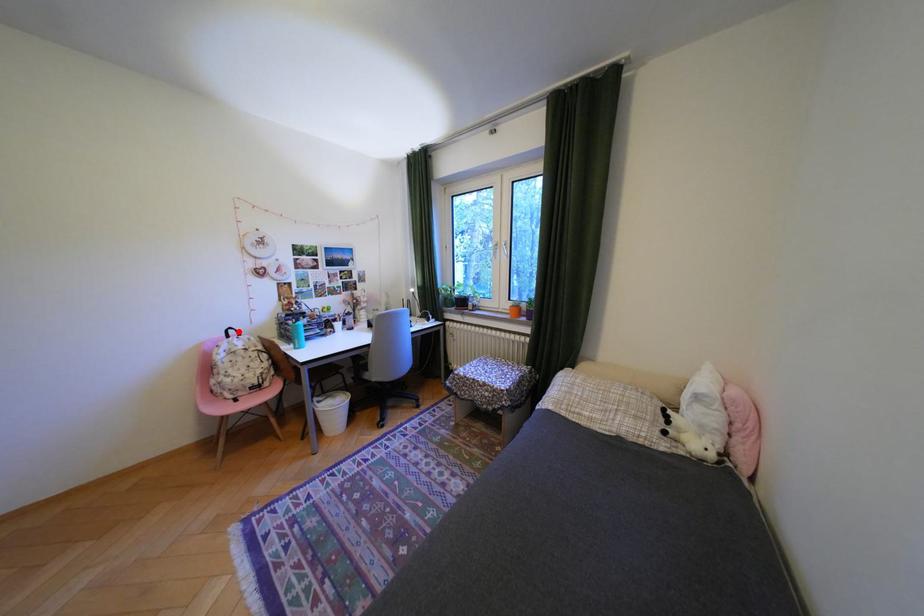
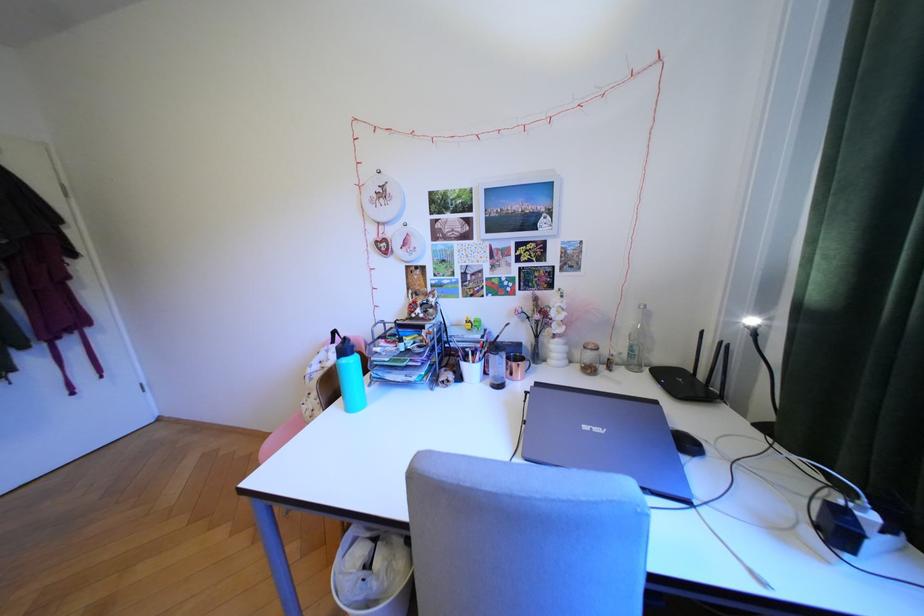
In the second image, find the point that corresponds to the highlighted location in the first image.

(345, 334)